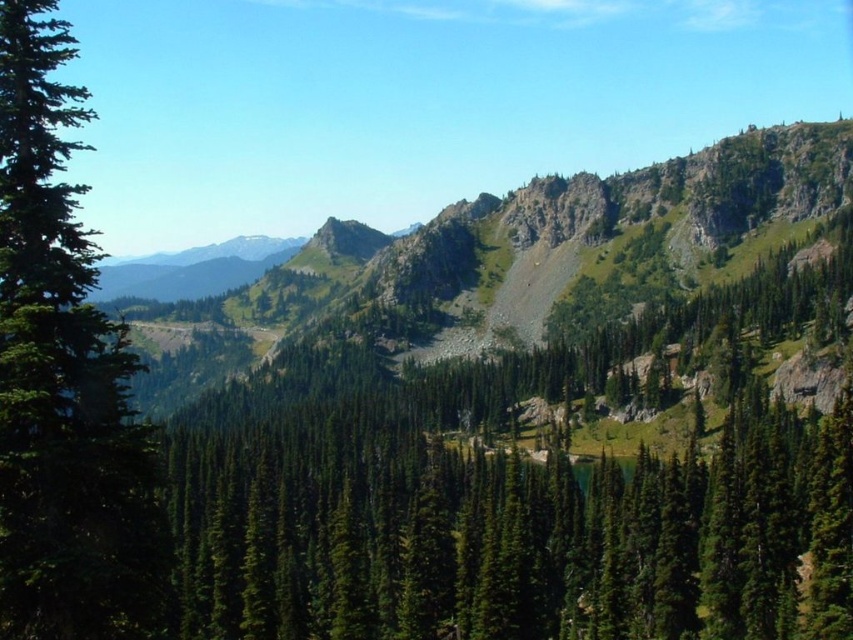
Question: Does green rocky mountain at center come in front of green matte tree at left?

Choices:
 (A) no
 (B) yes

Answer: (A)

Question: Is green rocky mountain at center smaller than green matte tree at left?

Choices:
 (A) yes
 (B) no

Answer: (B)

Question: Which object is farther from the camera taking this photo?

Choices:
 (A) green matte tree at left
 (B) green rocky mountain at center

Answer: (B)

Question: Is green rocky mountain at center thinner than green matte tree at left?

Choices:
 (A) yes
 (B) no

Answer: (B)